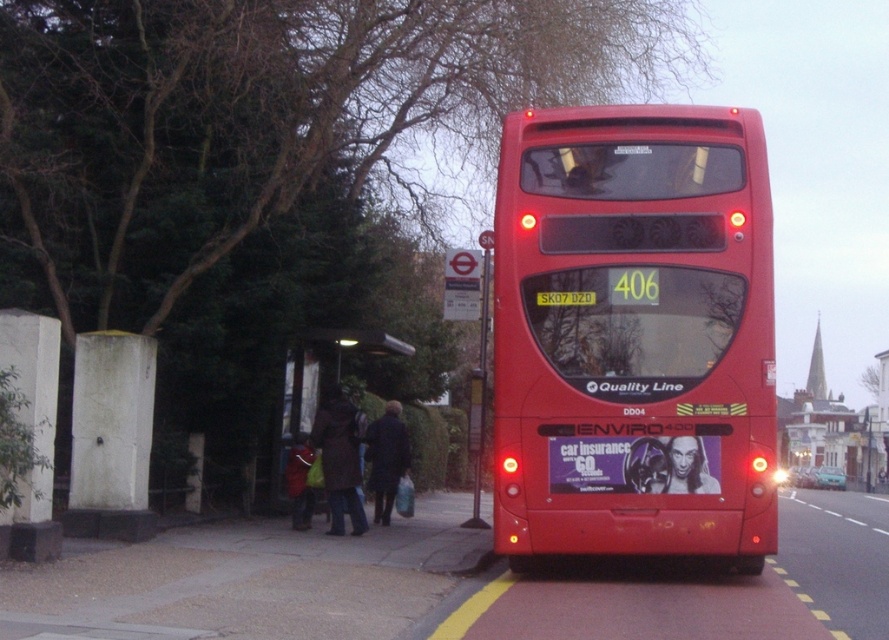
Based on the photo, you are a passenger waiting at the bus stop. You need to board the matte red bus at center. Which direction should you walk from the dark brown wooden bench at center to reach the bus?

The matte red bus at center is above the dark brown wooden bench at center, so you should walk forward towards the bus from the bench.

You are a person waiting at the bus stop and want to sit on the dark brown wooden bench at center. Is the matte red bus at center blocking your path to the bench?

The matte red bus at center has a larger size compared to dark brown wooden bench at center, so yes, the bus is blocking your path to the bench.